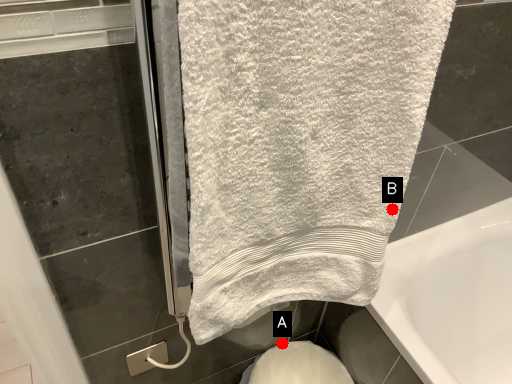
Question: Two points are circled on the image, labeled by A and B beside each circle. Which of the following is the farthest from the observer?

Choices:
 (A) A is further
 (B) B is further

Answer: (A)